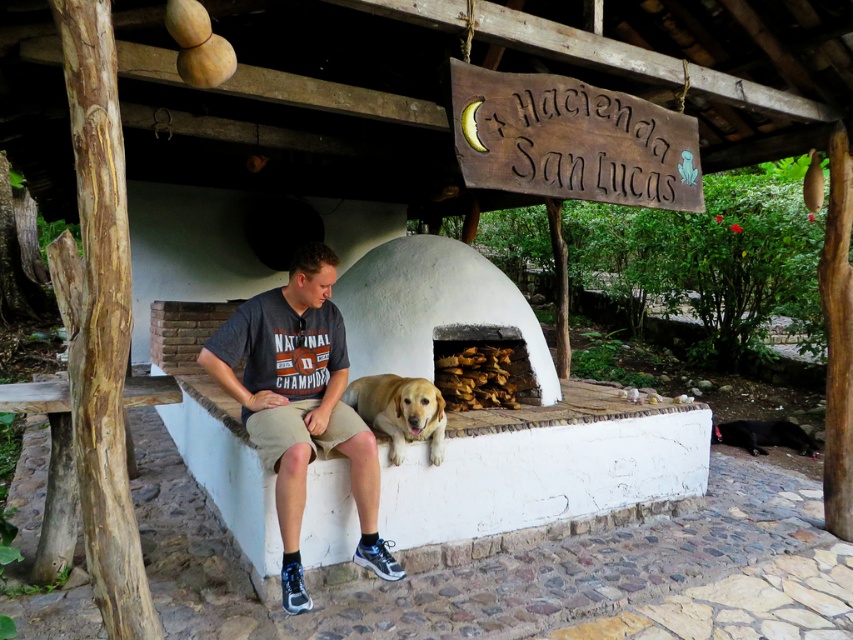
Is golden fur dog at center below black fur dog at lower right?

Incorrect, golden fur dog at center is not positioned below black fur dog at lower right.

Based on the photo, between golden fur dog at center and black fur dog at lower right, which one has more height?

golden fur dog at center

Between point (403, 448) and point (749, 433), which one is positioned in front?

Point (403, 448) is in front.

Find the location of a particular element. This screenshot has width=853, height=640. golden fur dog at center is located at coordinates (399, 410).

Between dark gray t-shirt at center and black fur dog at lower right, which one has less height?

With less height is black fur dog at lower right.

Consider the image. Is dark gray t-shirt at center thinner than black fur dog at lower right?

Yes, dark gray t-shirt at center is thinner than black fur dog at lower right.

Locate an element on the screen. The image size is (853, 640). dark gray t-shirt at center is located at coordinates (300, 404).

Is dark gray t-shirt at center positioned behind golden fur dog at center?

→ No, dark gray t-shirt at center is in front of golden fur dog at center.

Does point (311, 316) lie in front of point (433, 422)?

Yes.

I want to click on dark gray t-shirt at center, so click(x=300, y=404).